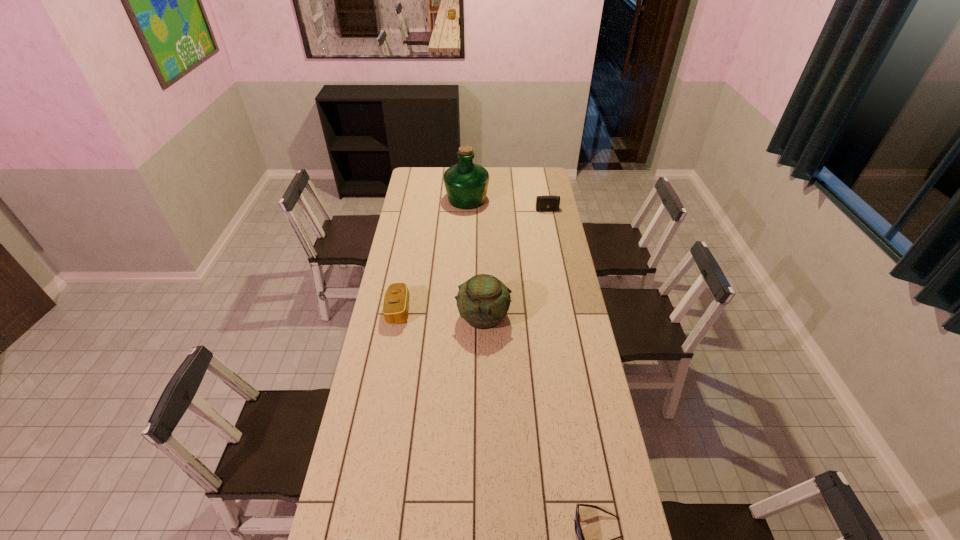
The width and height of the screenshot is (960, 540). I want to click on the tallest object, so click(x=466, y=183).

The image size is (960, 540). I want to click on the second tallest object, so click(483, 301).

Identify the location of the nearer clutch bag. The height and width of the screenshot is (540, 960). (395, 309).

Identify the location of the farther clutch bag. (543, 203).

Find the location of a particular element. The height and width of the screenshot is (540, 960). vacant area situated on the label side of the liquor is located at coordinates (548, 199).

Locate an element on the screen. vacant space located on the back of the pottery is located at coordinates (483, 267).

Find the location of a particular element. The height and width of the screenshot is (540, 960). vacant space situated 0.350m on the zipper side of the nearer clutch bag is located at coordinates (489, 310).

Where is `free location located on the front flap of the right clutch bag`? The height and width of the screenshot is (540, 960). free location located on the front flap of the right clutch bag is located at coordinates (551, 230).

The width and height of the screenshot is (960, 540). I want to click on object at the left edge, so click(395, 309).

Where is `object positioned at the right edge`? object positioned at the right edge is located at coordinates (543, 203).